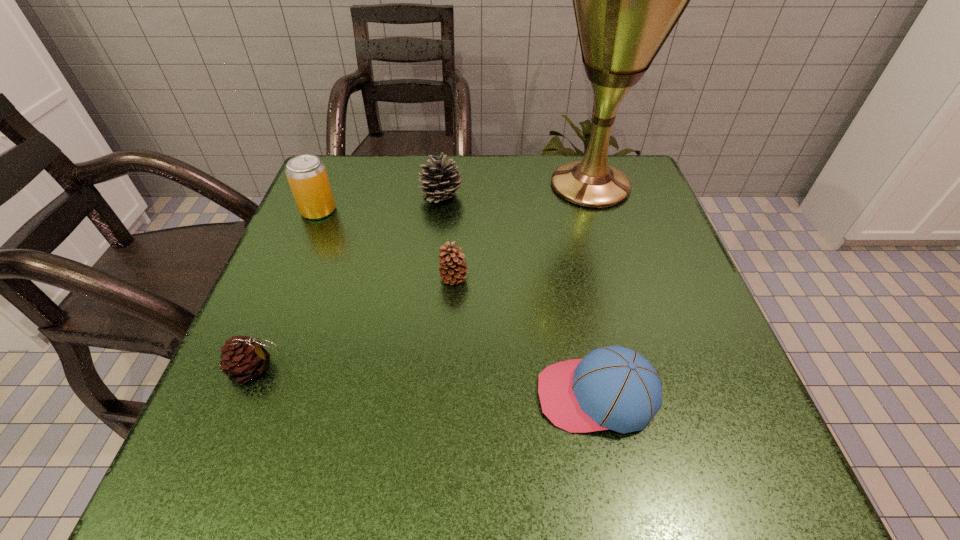
Find the location of a particular element. The image size is (960, 540). trophy cup is located at coordinates (627, 0).

You are a GUI agent. You are given a task and a screenshot of the screen. Output one action in this format:
    pyautogui.click(x=<x>, y=<y>)
    Task: Click on the pop (soda)
    
    Given the screenshot: What is the action you would take?
    pyautogui.click(x=307, y=176)

This screenshot has width=960, height=540. I want to click on the fourth shortest object, so click(x=439, y=181).

At what (x,y) coordinates should I click in order to perform the action: click on the tallest pinecone. Please return your answer as a coordinate pair (x, y). The height and width of the screenshot is (540, 960). Looking at the image, I should click on (439, 181).

Locate an element on the screen. the third nearest object is located at coordinates (453, 269).

Where is `baseball cap`? The width and height of the screenshot is (960, 540). baseball cap is located at coordinates (613, 387).

I want to click on the shortest pinecone, so click(243, 358).

Locate an element on the screen. This screenshot has height=540, width=960. the leftmost pinecone is located at coordinates 243,358.

Find the location of a particular element. free space located 0.080m on the left of the trophy cup is located at coordinates (508, 185).

The height and width of the screenshot is (540, 960). Identify the location of free region located on the right of the pop (soda). (389, 211).